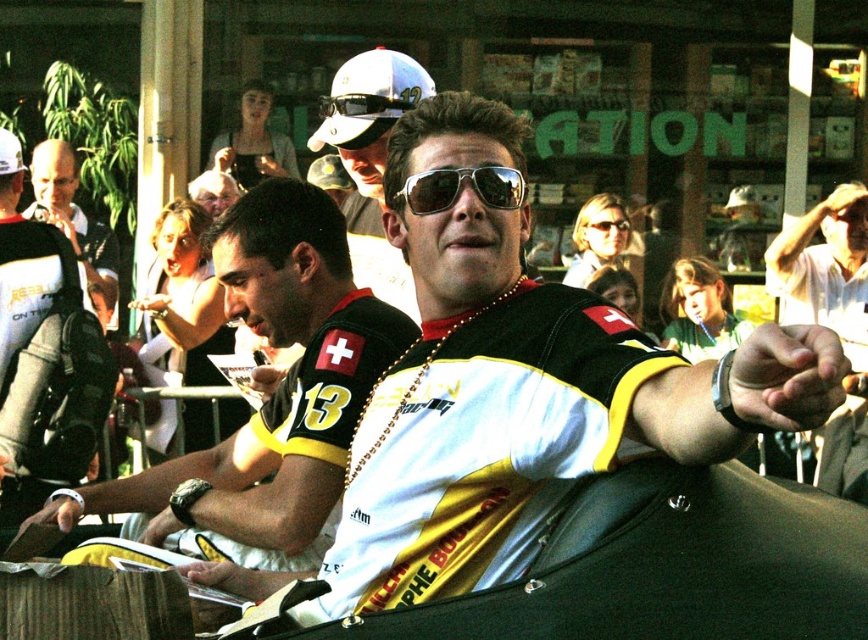
Question: Is sunglasses at center to the right of shiny black sunglasses at center from the viewer's perspective?

Choices:
 (A) yes
 (B) no

Answer: (A)

Question: Estimate the real-world distances between objects in this image. Which object is closer to the sunglasses at center?

Choices:
 (A) yellow jersey at center
 (B) matte black camera at left
 (C) shiny black sunglasses at center

Answer: (A)

Question: Among these points, which one is farthest from the camera?

Choices:
 (A) (113, 273)
 (B) (470, 173)

Answer: (A)

Question: Where is matte black camera at left located in relation to sunglasses at center in the image?

Choices:
 (A) below
 (B) above

Answer: (B)

Question: Can you confirm if yellow jersey at center is bigger than matte black camera at left?

Choices:
 (A) yes
 (B) no

Answer: (A)

Question: Among these points, which one is nearest to the camera?

Choices:
 (A) (542, 467)
 (B) (858, 464)
 (C) (360, 340)
 (D) (372, 100)

Answer: (A)